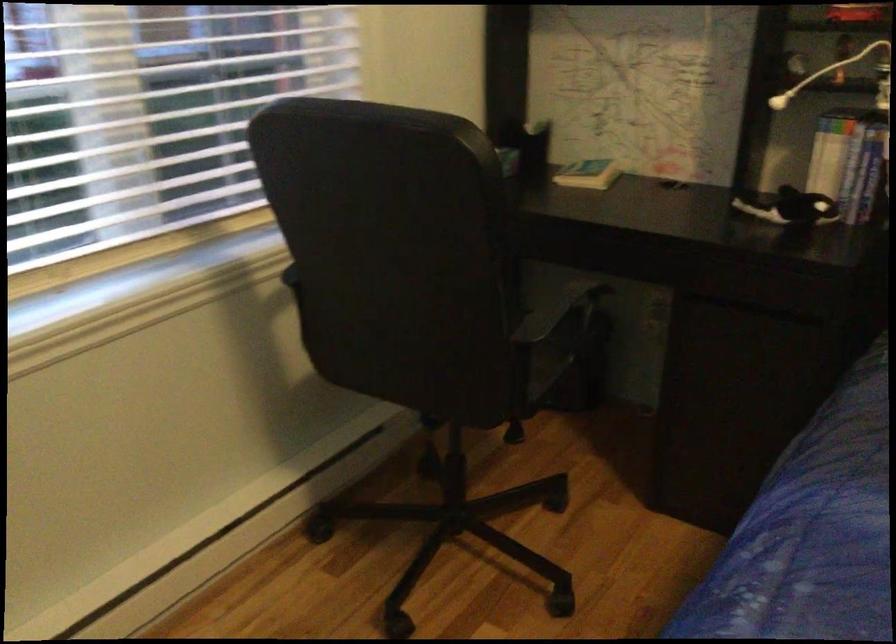
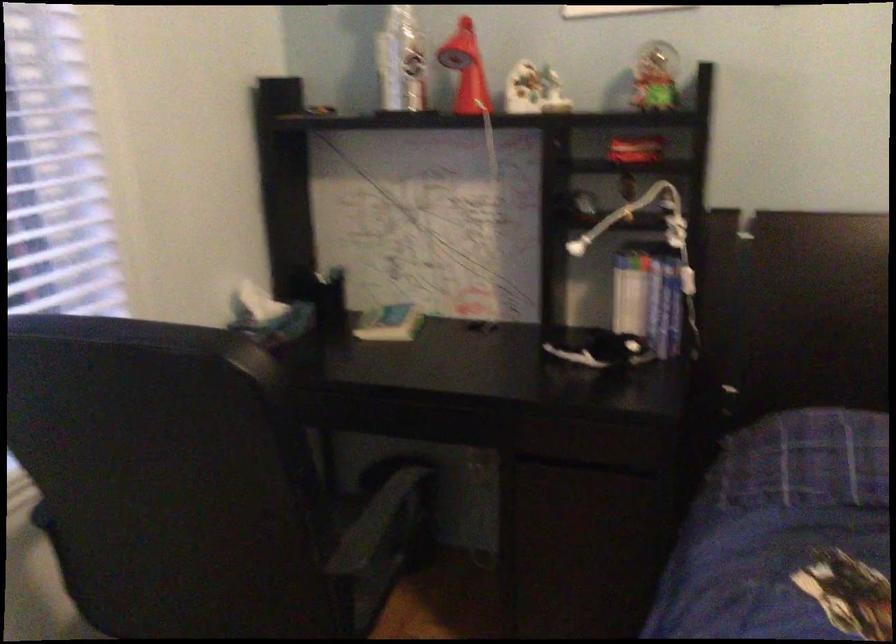
Question: The camera is either moving clockwise (left) or counter-clockwise (right) around the object. The first image is from the beginning of the video and the second image is from the end. Is the camera moving left or right when shooting the video?

Choices:
 (A) Left
 (B) Right

Answer: (A)